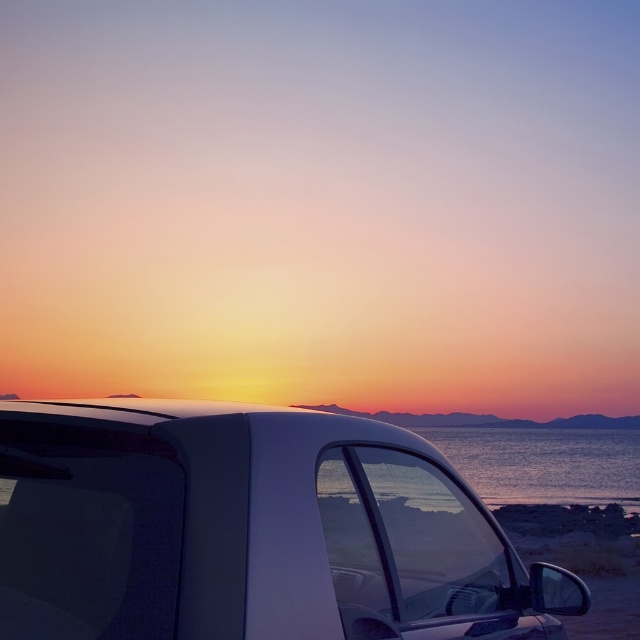
Question: Which point is closer to the camera taking this photo?

Choices:
 (A) (125, 540)
 (B) (432, 436)

Answer: (A)

Question: Is white glossy car at center wider than shiny blue water at center?

Choices:
 (A) yes
 (B) no

Answer: (B)

Question: Which object appears farthest from the camera in this image?

Choices:
 (A) shiny blue water at center
 (B) white glossy car at center

Answer: (A)

Question: Can you confirm if white glossy car at center is wider than shiny blue water at center?

Choices:
 (A) yes
 (B) no

Answer: (B)

Question: Is white glossy car at center to the right of shiny blue water at center from the viewer's perspective?

Choices:
 (A) yes
 (B) no

Answer: (B)